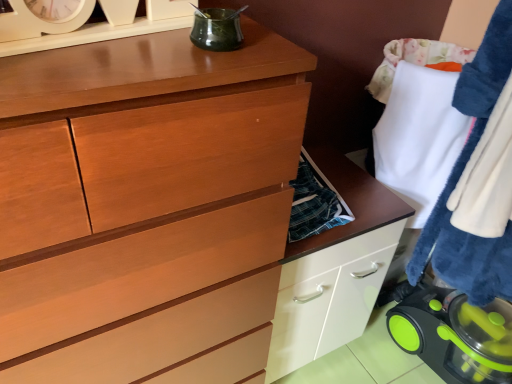
Question: Considering the positions of point (199, 31) and point (503, 312), is point (199, 31) closer or farther from the camera than point (503, 312)?

Choices:
 (A) closer
 (B) farther

Answer: (A)

Question: Based on their positions, is green glass jar at upper center, the second appliance viewed from the back, located to the left or right of green plastic vacuum cleaner at lower right, acting as the second appliance starting from the left?

Choices:
 (A) left
 (B) right

Answer: (A)

Question: Based on their relative distances, which object is nearer to the green plastic vacuum cleaner at lower right, acting as the second appliance starting from the left?

Choices:
 (A) white fluffy towel at right
 (B) green glass jar at upper center, which is counted as the first appliance, starting from the front

Answer: (A)

Question: Which is farther from the green glass jar at upper center, the second appliance viewed from the back?

Choices:
 (A) green plastic vacuum cleaner at lower right, acting as the second appliance starting from the left
 (B) white fluffy towel at right

Answer: (A)